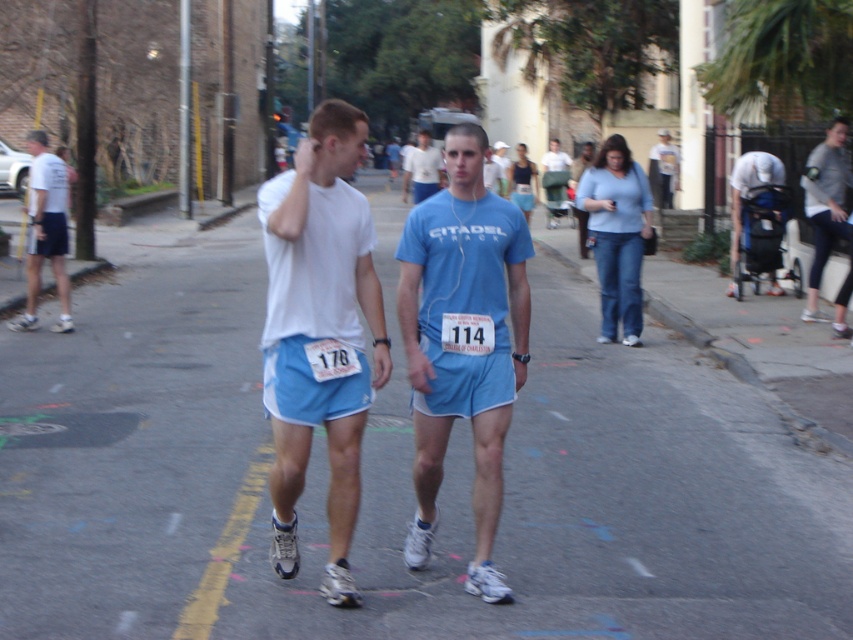
Which is behind, point (245, 349) or point (816, 291)?

The point (816, 291) is behind.

Between gray asphalt road at center and gray fabric jacket at upper right, which one appears on the left side from the viewer's perspective?

Positioned to the left is gray asphalt road at center.

Does point (386, 589) come in front of point (827, 188)?

Yes, it is.

Find the location of a particular element. gray asphalt road at center is located at coordinates (398, 483).

Between point (583, 438) and point (558, 170), which one is positioned behind?

Point (558, 170)

Looking at this image, can you confirm if gray asphalt road at center is positioned to the left of matte blue shorts at center?

Yes, gray asphalt road at center is to the left of matte blue shorts at center.

Between point (737, 442) and point (556, 209), which one is positioned behind?

The point (556, 209) is more distant.

At what (x,y) coordinates should I click in order to perform the action: click on gray asphalt road at center. Please return your answer as a coordinate pair (x, y). This screenshot has height=640, width=853. Looking at the image, I should click on pos(398,483).

Locate an element on the screen. Image resolution: width=853 pixels, height=640 pixels. light blue fabric shorts at center is located at coordinates (462, 340).

Is light blue fabric shorts at center below blue fabric stroller at right?

Correct, light blue fabric shorts at center is located below blue fabric stroller at right.

Locate an element on the screen. This screenshot has width=853, height=640. light blue fabric shorts at center is located at coordinates (462, 340).

Where is `light blue fabric shorts at center`? light blue fabric shorts at center is located at coordinates (462, 340).